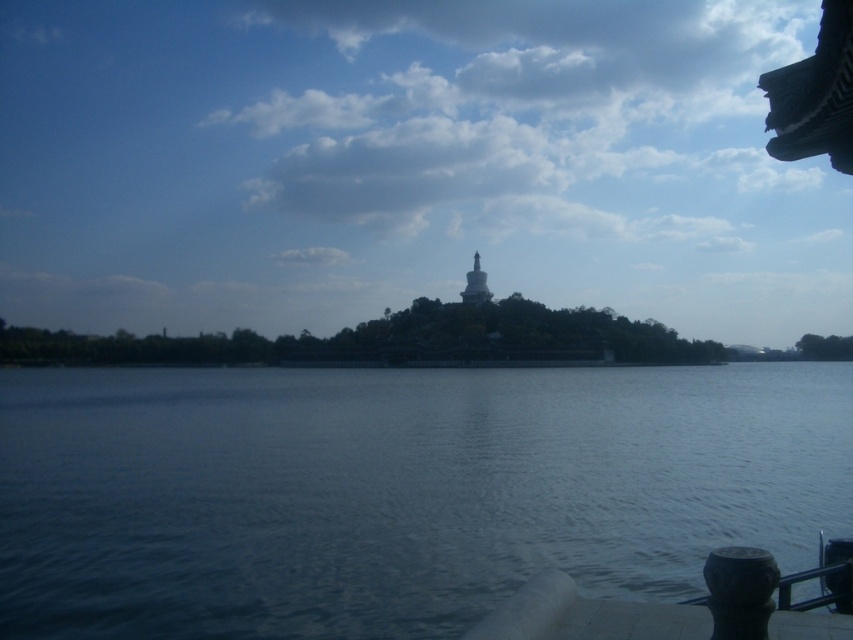
Between dark blue water at center and white glossy tower at center, which one is positioned higher?

white glossy tower at center is higher up.

Does dark blue water at center appear on the right side of white glossy tower at center?

In fact, dark blue water at center is to the left of white glossy tower at center.

Who is more distant from viewer, (88, 378) or (473, 292)?

Positioned behind is point (473, 292).

What are the coordinates of `dark blue water at center` in the screenshot? It's located at (395, 492).